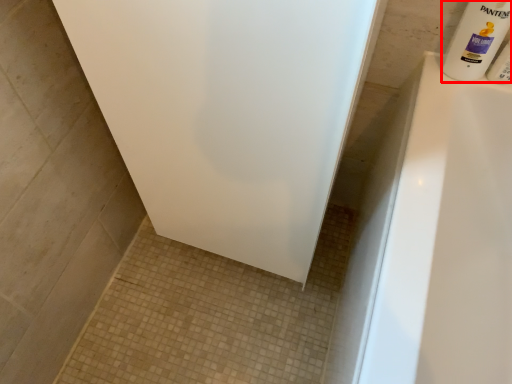
Question: Observing the image, what is the correct spatial positioning of cleaning product (annotated by the red box) in reference to toiletry?

Choices:
 (A) left
 (B) right

Answer: (A)